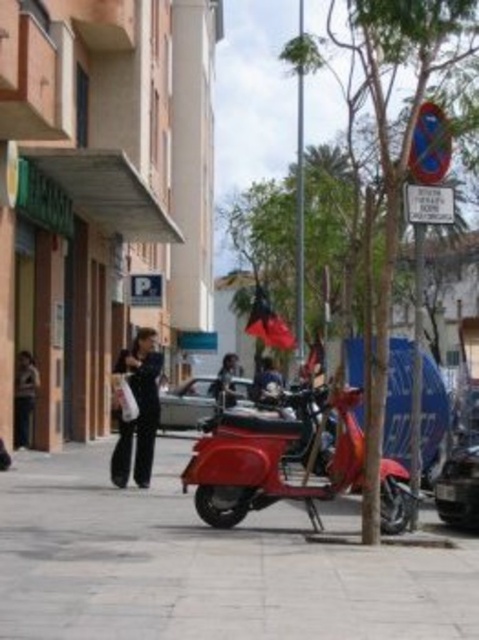
Question: Can you confirm if black pants at center is positioned below dark brown leather jacket at center?

Choices:
 (A) yes
 (B) no

Answer: (A)

Question: Which point is farther to the camera?

Choices:
 (A) (261, 384)
 (B) (19, 371)
 (C) (243, 403)
 (D) (241, 541)

Answer: (C)

Question: Can you confirm if smooth concrete pavement at center is positioned below metallic silver car at lower right?

Choices:
 (A) no
 (B) yes

Answer: (B)

Question: Is the position of metallic silver car at lower right less distant than that of black pants at center?

Choices:
 (A) yes
 (B) no

Answer: (A)

Question: Among these points, which one is nearest to the camera?

Choices:
 (A) (409, 628)
 (B) (15, 385)

Answer: (A)

Question: Considering the real-world distances, which object is farthest from the black pants at center?

Choices:
 (A) silver metallic car at center
 (B) smooth concrete pavement at center

Answer: (B)